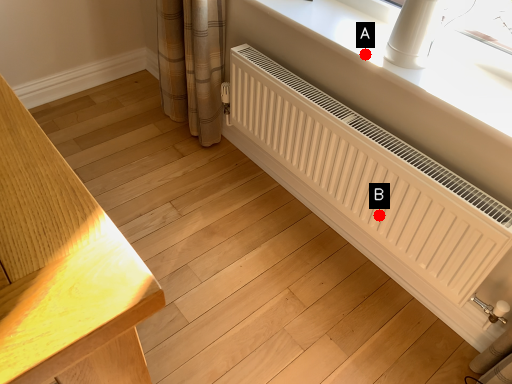
Question: Two points are circled on the image, labeled by A and B beside each circle. Which point is further to the camera?

Choices:
 (A) A is further
 (B) B is further

Answer: (B)